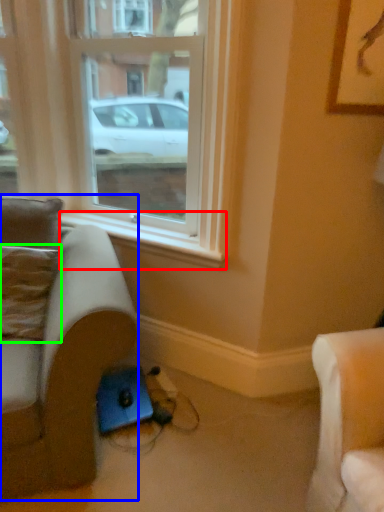
Question: Based on their relative distances, which object is farther from window sill (highlighted by a red box)? Choose from studio couch (highlighted by a blue box) and pillow (highlighted by a green box).

Choices:
 (A) studio couch
 (B) pillow

Answer: (A)